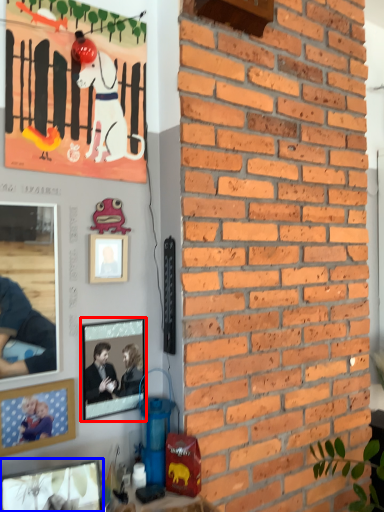
Question: Among these objects, which one is nearest to the camera, picture frame (highlighted by a red box) or picture frame (highlighted by a blue box)?

Choices:
 (A) picture frame
 (B) picture frame

Answer: (B)